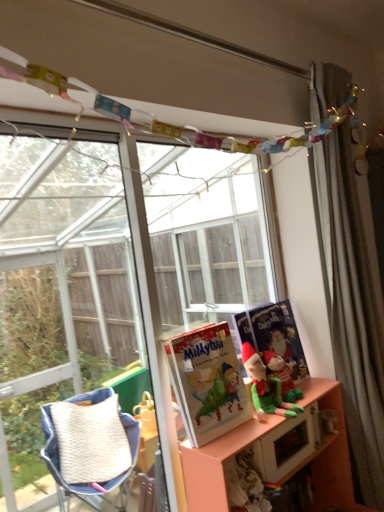
At what (x,y) coordinates should I click in order to perform the action: click on transparent glass window at upper center. Please return your answer as a coordinate pair (x, y). The height and width of the screenshot is (512, 384). Looking at the image, I should click on (65, 261).

What do you see at coordinates (207, 382) in the screenshot?
I see `matte paper book at center` at bounding box center [207, 382].

Locate an element on the screen. green fabric elf at center is located at coordinates (266, 384).

Image resolution: width=384 pixels, height=512 pixels. What are the coordinates of `pink matte shelf at lower right` in the screenshot? It's located at click(x=277, y=455).

From a real-world perspective, between green fabric elf at center and pink matte shelf at lower right, who is vertically lower?

In real-world perspective, pink matte shelf at lower right is lower.

In the image, is green fabric elf at center on the left side or the right side of pink matte shelf at lower right?

Based on their positions, green fabric elf at center is located to the left of pink matte shelf at lower right.

Which is closer, (270,381) or (323,472)?

Point (270,381) appears to be closer to the viewer than point (323,472).

In the scene shown: Who is more distant, green fabric elf at center or pink matte shelf at lower right?

green fabric elf at center is further away from the camera.

Would you say matte blue paperback book at right is outside transparent glass window at upper center?

Absolutely, matte blue paperback book at right is external to transparent glass window at upper center.

Is matte blue paperback book at right turned away from transparent glass window at upper center?

Correct, matte blue paperback book at right is looking away from transparent glass window at upper center.

From the image's perspective, is matte blue paperback book at right located above transparent glass window at upper center?

Actually, matte blue paperback book at right appears below transparent glass window at upper center in the image.

From their relative heights in the image, would you say matte blue paperback book at right is taller or shorter than transparent glass window at upper center?

In the image, matte blue paperback book at right appears to be shorter than transparent glass window at upper center.

From the picture: Is pink matte shelf at lower right outside of matte blue paperback book at right?

Yes, pink matte shelf at lower right is outside of matte blue paperback book at right.

Considering the relative sizes of pink matte shelf at lower right and matte blue paperback book at right in the image provided, is pink matte shelf at lower right thinner than matte blue paperback book at right?

Incorrect, the width of pink matte shelf at lower right is not less than that of matte blue paperback book at right.

From a real-world perspective, which is physically above, pink matte shelf at lower right or matte blue paperback book at right?

From a 3D spatial view, matte blue paperback book at right is above.

Is matte paper book at center outside of transparent glass window at upper center?

Absolutely, matte paper book at center is external to transparent glass window at upper center.

In the scene shown: Is matte paper book at center looking in the opposite direction of transparent glass window at upper center?

Yes, matte paper book at center is facing away from transparent glass window at upper center.

Who is shorter, matte paper book at center or transparent glass window at upper center?

matte paper book at center.

In the scene shown: Can you tell me how much green fabric elf at center and transparent glass window at upper center differ in facing direction?

The angle between the facing direction of green fabric elf at center and the facing direction of transparent glass window at upper center is 1.34 degrees.

From a real-world perspective, is green fabric elf at center physically located above or below transparent glass window at upper center?

In terms of real-world spatial position, green fabric elf at center is below transparent glass window at upper center.

Between green fabric elf at center and transparent glass window at upper center, which one has larger size?

transparent glass window at upper center.

Is green fabric elf at center oriented away from transparent glass window at upper center?

Yes, transparent glass window at upper center is at the back of green fabric elf at center.

Which of these two, matte paper book at center or green fabric elf at center, is wider?

green fabric elf at center is wider.

Is matte paper book at center outside of green fabric elf at center?

matte paper book at center lies outside green fabric elf at center's area.

Is matte paper book at center to the right of green fabric elf at center from the viewer's perspective?

In fact, matte paper book at center is to the left of green fabric elf at center.

Can you confirm if silky gray curtain at right is bigger than matte blue paperback book at right?

Yes.

From the image's perspective, is silky gray curtain at right on matte blue paperback book at right?

Yes.

Is the surface of silky gray curtain at right in direct contact with matte blue paperback book at right?

No.

What are the coordinates of `shelf on the right of the green fabric elf at center` in the screenshot? It's located at (277, 455).

Where is `paperback book below the transparent glass window at upper center (from a real-world perspective)`? The height and width of the screenshot is (512, 384). paperback book below the transparent glass window at upper center (from a real-world perspective) is located at coordinates (275, 339).

Based on their spatial positions, is transparent glass window at upper center or pink matte shelf at lower right further from green fabric elf at center?

transparent glass window at upper center is further to green fabric elf at center.

From the picture: Estimate the real-world distances between objects in this image. Which object is further from silky gray curtain at right, matte paper book at center or green fabric elf at center?

Based on the image, matte paper book at center appears to be further to silky gray curtain at right.

Based on their spatial positions, is matte blue paperback book at right or pink matte shelf at lower right further from matte paper book at center?

matte blue paperback book at right.

When comparing their distances from transparent glass window at upper center, does green fabric elf at center or silky gray curtain at right seem further?

Based on the image, silky gray curtain at right appears to be further to transparent glass window at upper center.

Looking at this image, estimate the real-world distances between objects in this image. Which object is further from pink matte shelf at lower right, silky gray curtain at right or matte blue paperback book at right?

The object further to pink matte shelf at lower right is silky gray curtain at right.

When comparing their distances from pink matte shelf at lower right, does transparent glass window at upper center or matte paper book at center seem closer?

Based on the image, matte paper book at center appears to be nearer to pink matte shelf at lower right.

Which object lies nearer to the anchor point pink matte shelf at lower right, matte paper book at center or transparent glass window at upper center?

The object closer to pink matte shelf at lower right is matte paper book at center.

When comparing their distances from matte blue paperback book at right, does silky gray curtain at right or transparent glass window at upper center seem closer?

Based on the image, silky gray curtain at right appears to be nearer to matte blue paperback book at right.

The width and height of the screenshot is (384, 512). I want to click on book between transparent glass window at upper center and matte blue paperback book at right along the z-axis, so click(x=207, y=382).

In order to click on paperback book located between transparent glass window at upper center and silky gray curtain at right in the left-right direction in this screenshot , I will do `click(275, 339)`.

Image resolution: width=384 pixels, height=512 pixels. What are the coordinates of `book situated between transparent glass window at upper center and silky gray curtain at right from left to right` in the screenshot? It's located at (207, 382).

What are the coordinates of `window between silky gray curtain at right and pink matte shelf at lower right in the up-down direction` in the screenshot? It's located at (65, 261).